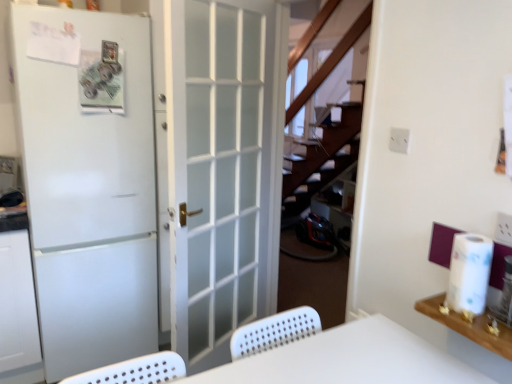
Where is `free space in front of white paper at right`? The height and width of the screenshot is (384, 512). free space in front of white paper at right is located at coordinates (483, 327).